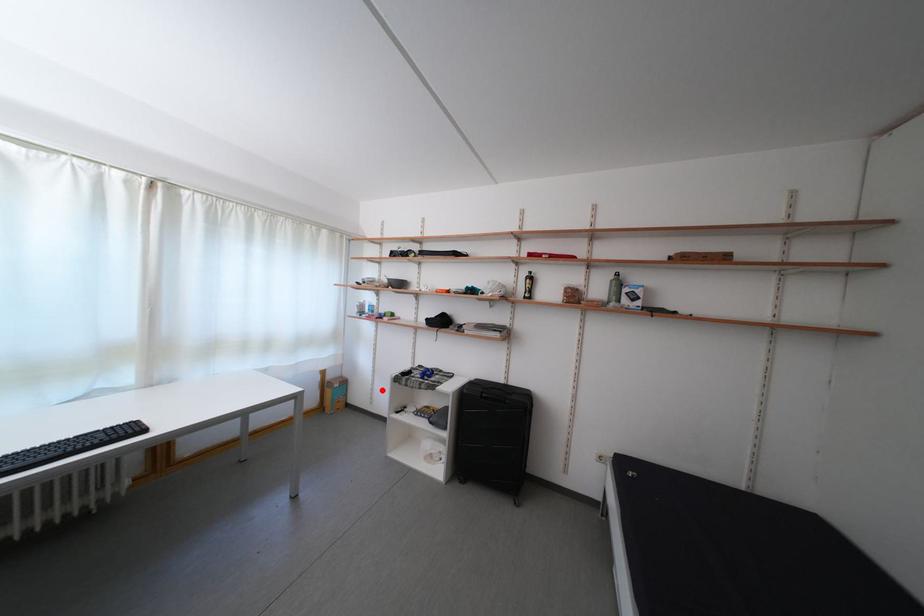
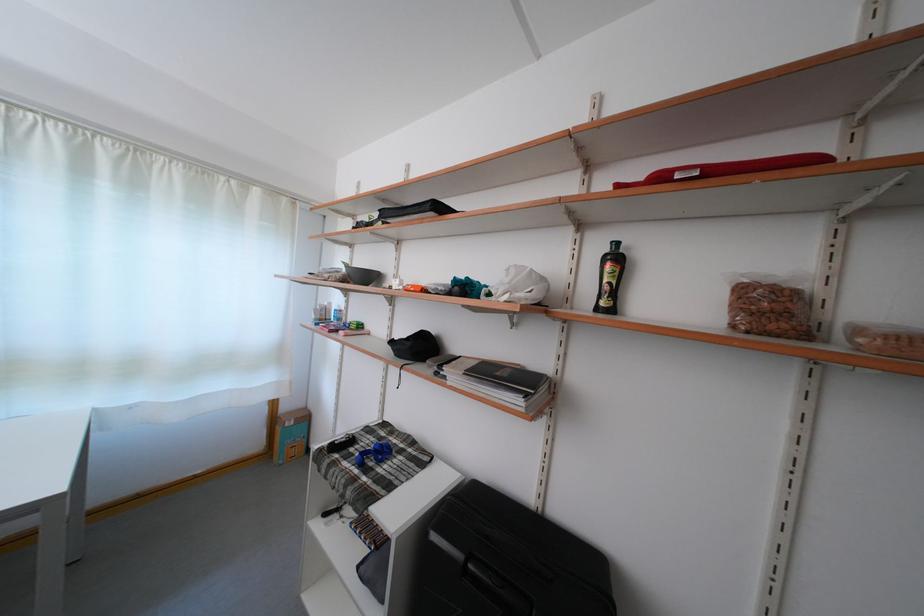
The point at the highlighted location is marked in the first image. Where is the corresponding point in the second image?

(344, 436)